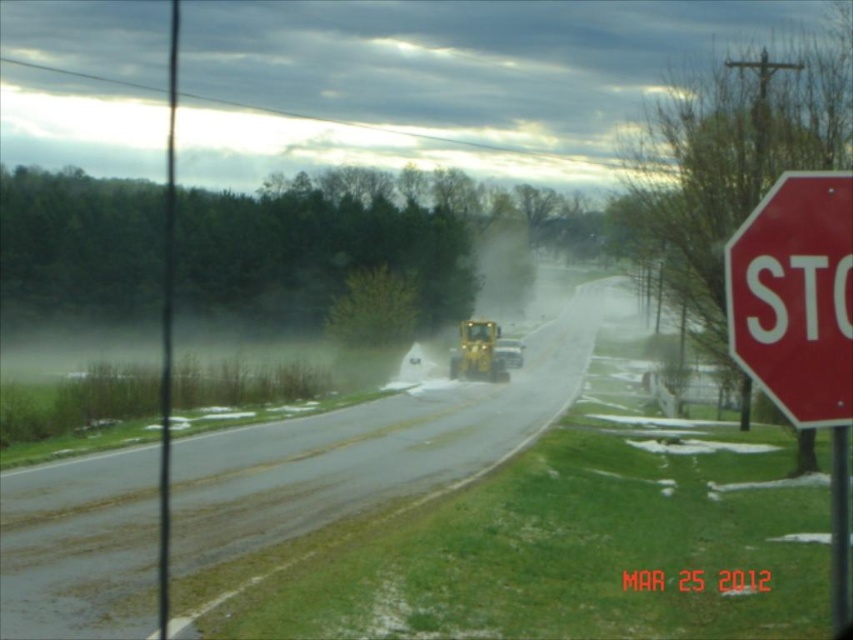
You are a pedestrian trying to cross the road. You see the red matte stop sign at right and the yellow rubber tractor at center. Which object is wider from your perspective?

The yellow rubber tractor at center is wider than the red matte stop sign at right.